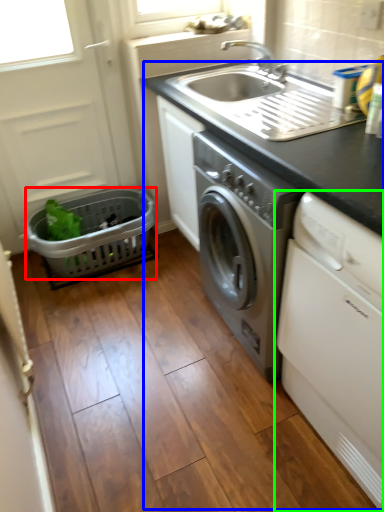
Question: Based on their relative distances, which object is nearer to basket (highlighted by a red box)? Choose from appliance (highlighted by a blue box) and washing machine (highlighted by a green box).

Choices:
 (A) appliance
 (B) washing machine

Answer: (A)